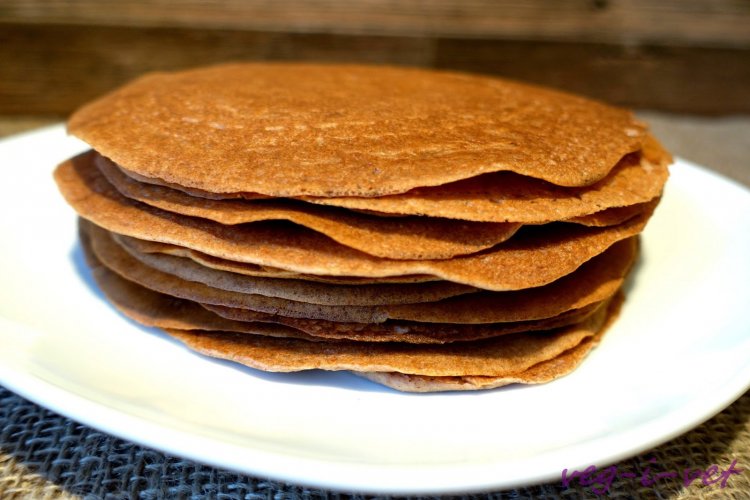
Locate an element on the screen. The image size is (750, 500). placemat is located at coordinates (84, 475).